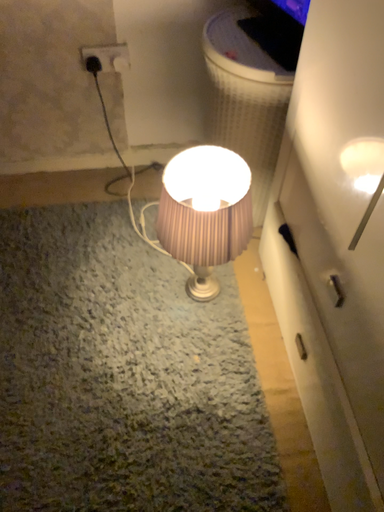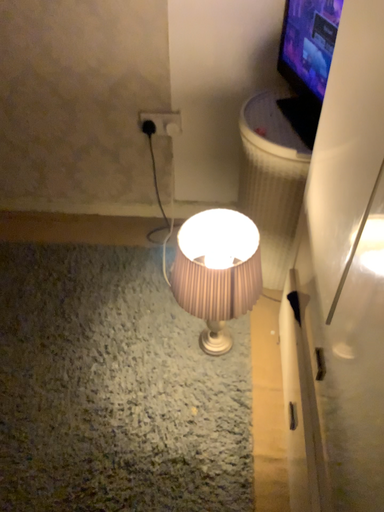
Question: How did the camera likely rotate when shooting the video?

Choices:
 (A) rotated left
 (B) rotated right

Answer: (A)